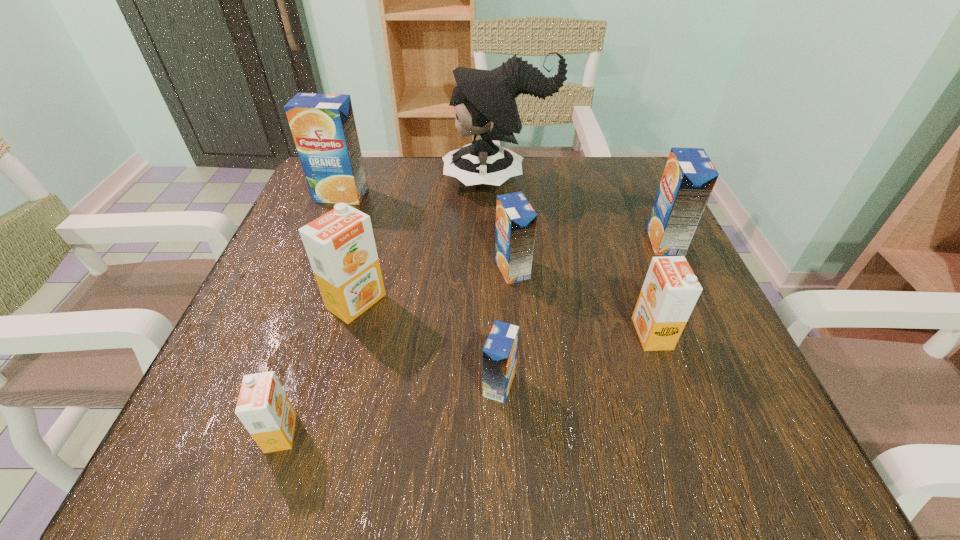
Locate an element on the screen. This screenshot has height=540, width=960. the tallest object is located at coordinates (484, 101).

You are a GUI agent. You are given a task and a screenshot of the screen. Output one action in this format:
    pyautogui.click(x=<x>, y=<y>)
    Task: Click on the leftmost blue orange_juice
    Image resolution: width=960 pixels, height=540 pixels.
    Given the screenshot: What is the action you would take?
    pyautogui.click(x=323, y=126)

Find the location of a particular element. Image resolution: width=960 pixels, height=540 pixels. the biggest blue orange_juice is located at coordinates [x=323, y=126].

The width and height of the screenshot is (960, 540). Find the location of `the rightmost blue orange_juice`. the rightmost blue orange_juice is located at coordinates (689, 177).

You are a GUI agent. You are given a task and a screenshot of the screen. Output one action in this format:
    pyautogui.click(x=<x>, y=<y>)
    Task: Click on the third smallest blue orange_juice
    The image size is (960, 540).
    Given the screenshot: What is the action you would take?
    (689, 177)

At what (x,y) coordinates should I click in order to perform the action: click on the biggest orange orange juice. Please return your answer as a coordinate pair (x, y). This screenshot has height=540, width=960. Looking at the image, I should click on tap(340, 245).

The height and width of the screenshot is (540, 960). I want to click on the second smallest blue orange_juice, so click(x=516, y=220).

Find the location of a particular element. This screenshot has width=960, height=540. the second orange juice from right to left is located at coordinates (670, 291).

Identify the location of the second object from right to left. (670, 291).

Image resolution: width=960 pixels, height=540 pixels. What are the coordinates of `the smallest blue orange_juice` in the screenshot? It's located at (500, 351).